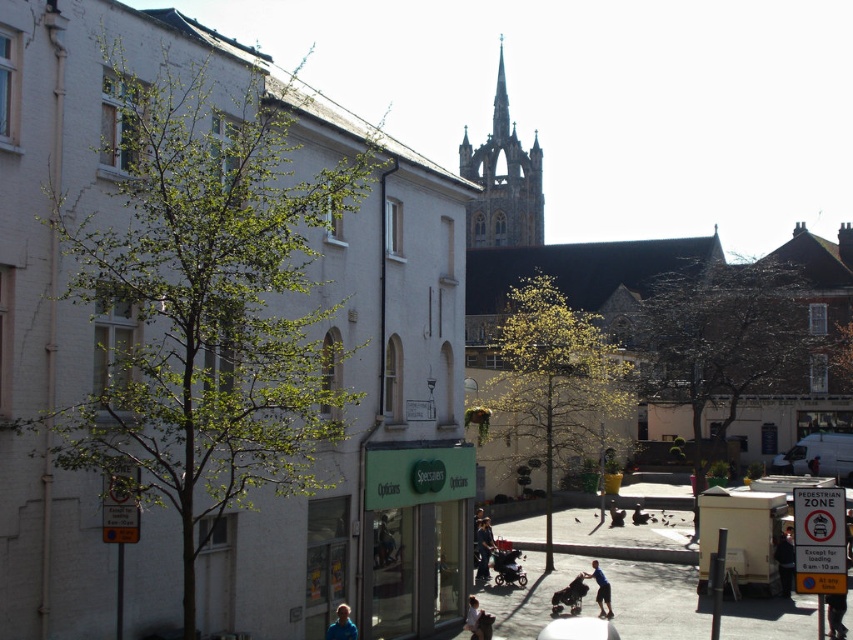
Who is shorter, green leafy tree at center or stone gothic spire at upper center?

Standing shorter between the two is green leafy tree at center.

Where is `green leafy tree at center`? green leafy tree at center is located at coordinates (554, 381).

The image size is (853, 640). Identify the location of green leafy tree at center. (554, 381).

Is green leafy tree at left bigger than brown textured tree at center?

No.

Who is positioned more to the left, green leafy tree at left or brown textured tree at center?

green leafy tree at left

The image size is (853, 640). Describe the element at coordinates (202, 301) in the screenshot. I see `green leafy tree at left` at that location.

Where is `green leafy tree at left`? green leafy tree at left is located at coordinates (202, 301).

Does brown textured tree at center have a smaller size compared to dark blue jeans at lower right?

Incorrect, brown textured tree at center is not smaller in size than dark blue jeans at lower right.

Does brown textured tree at center have a lesser width compared to dark blue jeans at lower right?

No.

The image size is (853, 640). Describe the element at coordinates (718, 344) in the screenshot. I see `brown textured tree at center` at that location.

The image size is (853, 640). What are the coordinates of `brown textured tree at center` in the screenshot? It's located at (718, 344).